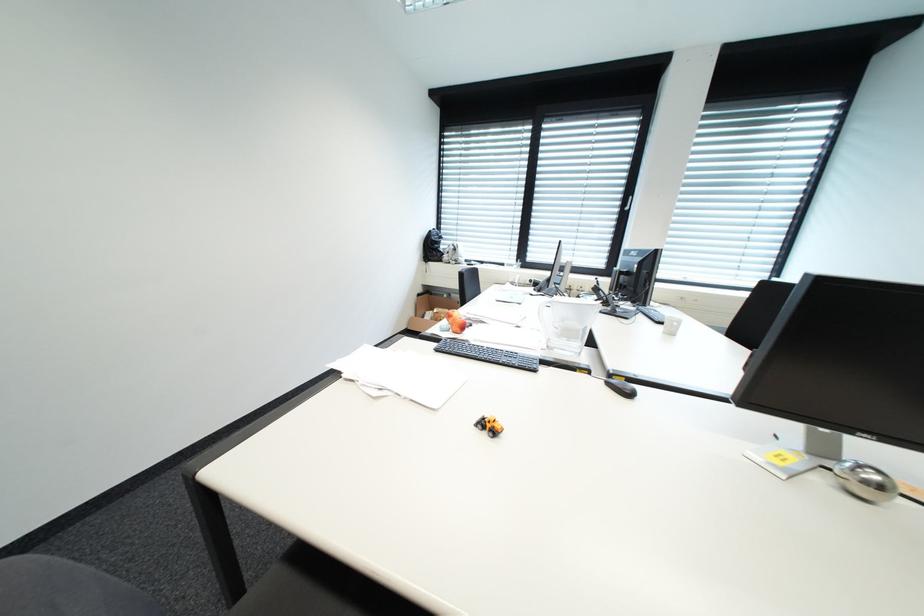
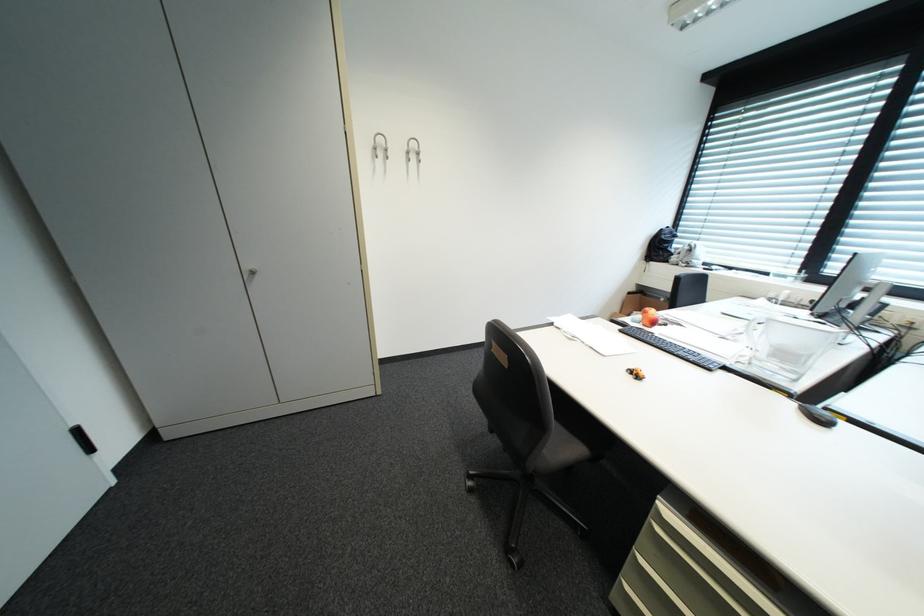
Question: The camera is either moving clockwise (left) or counter-clockwise (right) around the object. The first image is from the beginning of the video and the second image is from the end. Is the camera moving left or right when shooting the video?

Choices:
 (A) Left
 (B) Right

Answer: (B)